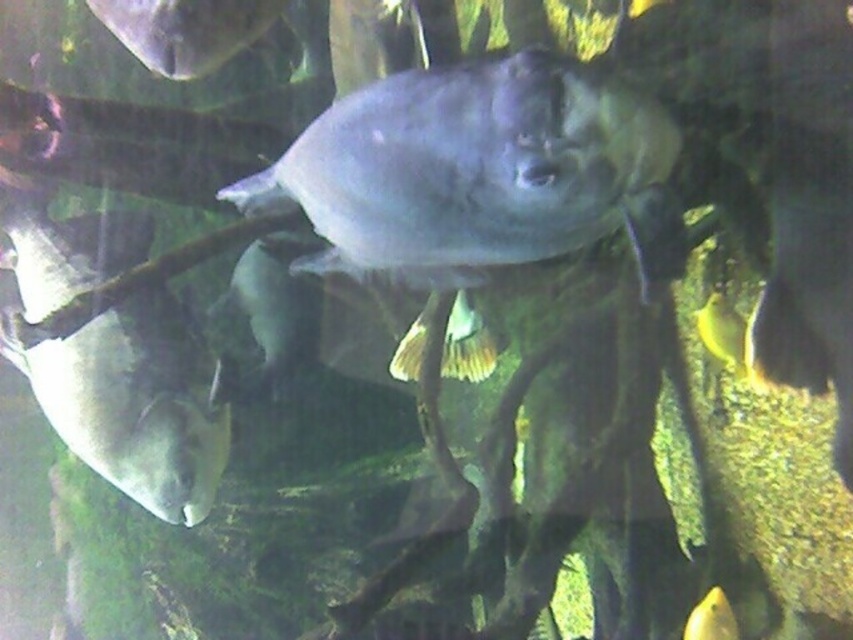
You are an underwater photographer aiming to capture a photo of the shiny silver fish at center and the matte gray fish at upper left. Based on their positions, which fish would appear closer to the camera lens in your photo?

The shiny silver fish at center is below the matte gray fish at upper left, so the matte gray fish at upper left would appear closer to the camera lens in the photo.

You are an underwater photographer aiming to capture the shiny silver fish at center. Your camera is at point [477,172]. Is the shiny silver fish at center in your camera frame?

The shiny silver fish at center is located exactly at point [477,172], so yes, the shiny silver fish at center is in your camera frame at that point.

You are a diver in an aquarium and want to reach a treasure chest located at point (x=164, y=24). You are currently at point (x=456, y=193). Which direction should you swim to get closer to the treasure chest?

Point (x=456, y=193) is closer to the viewer than point (x=164, y=24). To reach the treasure chest at point (x=164, y=24), you should swim away from the viewer, moving towards the background of the aquarium.